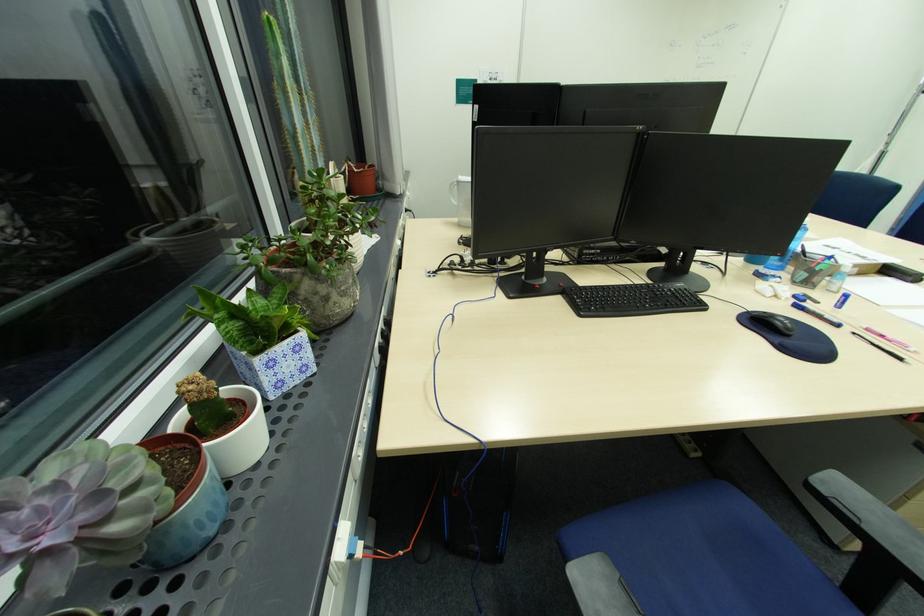
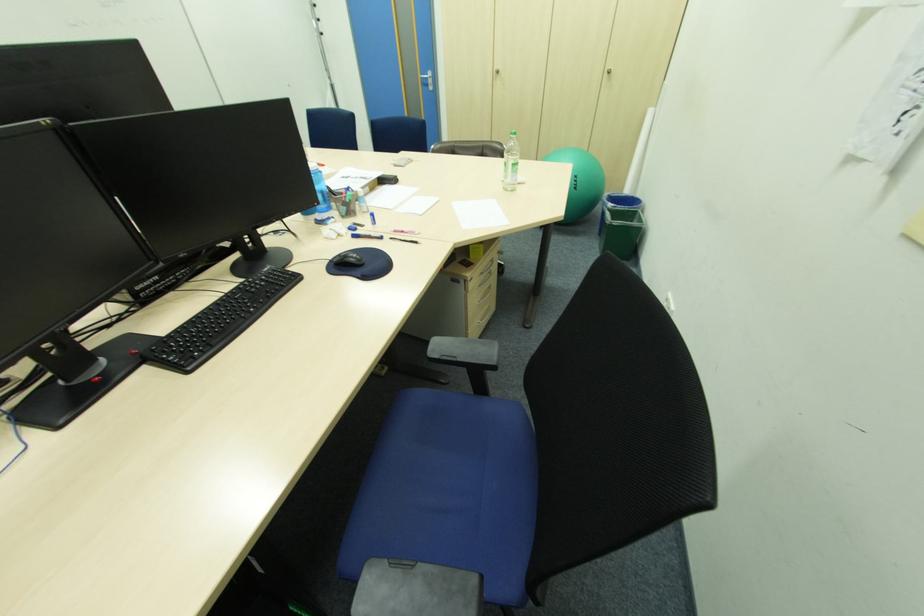
Where in the second image is the point corresponding to (860,334) from the first image?

(396, 238)